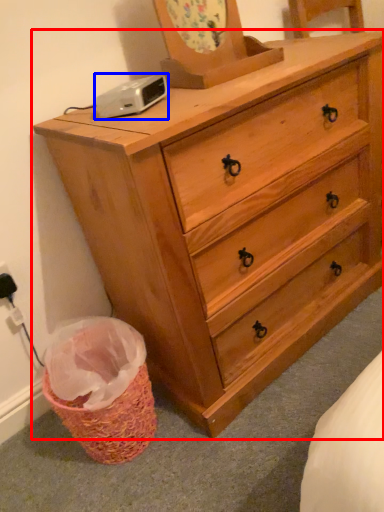
Question: Which object is closer to the camera taking this photo, chest of drawers (highlighted by a red box) or gadget (highlighted by a blue box)?

Choices:
 (A) chest of drawers
 (B) gadget

Answer: (A)